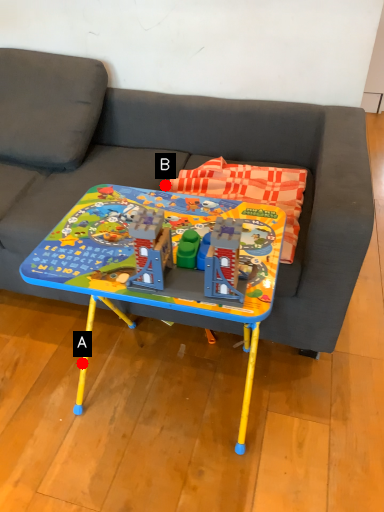
Question: Two points are circled on the image, labeled by A and B beside each circle. Among these points, which one is nearest to the camera?

Choices:
 (A) A is closer
 (B) B is closer

Answer: (A)